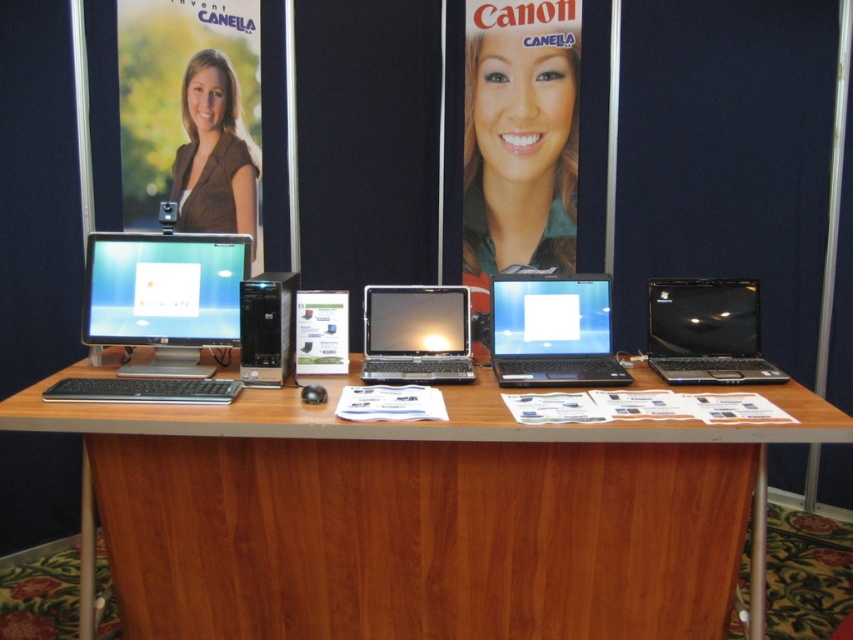
You are setting up a presentation at a trade show and need to place a 28 inch monitor between the matte black laptop at center and the black plastic desktop at center on the table. Is there enough space between them to fit the monitor?

The distance between the matte black laptop at center and the black plastic desktop at center is 27.30 inches. Since the monitor is 28 inches wide, it would not fit as the space is slightly smaller than the monitor.

You are setting up a display table for an exhibition. You have two laptops, a matte black laptop at center and a satin black laptop at center. The table has limited space between the two banners. Based on their widths, which laptop should you place closer to the edge to ensure both fit without overlapping?

The satin black laptop at center should be placed closer to the edge since it might be narrower than the matte black laptop at center, allowing both to fit without overlapping.

You are setting up a trade show booth and need to place a large promotional banner that requires a surface larger than the brown fabric poster at upper left. Can the brown wood computer desk at center accommodate it?

The brown wood computer desk at center is bigger than the brown fabric poster at upper left, so yes, the desk can accommodate the large promotional banner.